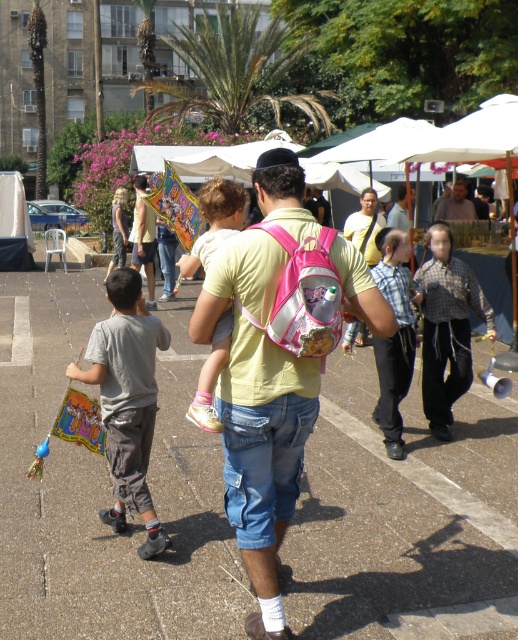
Question: Can you confirm if concrete at center is wider than checkered shirt at center?

Choices:
 (A) yes
 (B) no

Answer: (A)

Question: Does gray cotton shirt at left have a larger size compared to checkered shirt at center?

Choices:
 (A) yes
 (B) no

Answer: (B)

Question: Which object is positioned closest to the pink fabric backpack at center?

Choices:
 (A) checkered shirt at center
 (B) light blue denim jeans at center
 (C) pink fabric dress at center

Answer: (C)

Question: Which of these objects is positioned farthest from the pink fabric backpack at center?

Choices:
 (A) checkered shirt at center
 (B) concrete at center

Answer: (A)

Question: Which of these objects is positioned closest to the pink fabric backpack at center?

Choices:
 (A) concrete at center
 (B) gray cotton shirt at left
 (C) matte yellow shirt at center

Answer: (B)

Question: Is gray cotton shirt at left smaller than matte yellow shirt at center?

Choices:
 (A) no
 (B) yes

Answer: (A)